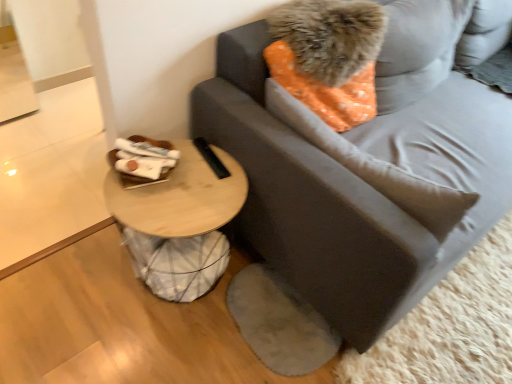
How much space does orange dotted fabric pillow at upper right, the first pillow positioned from the top, occupy vertically?

17.03 inches.

How much space does orange dotted fabric pillow at upper right, which is counted as the 2th pillow, starting from the bottom, occupy horizontally?

orange dotted fabric pillow at upper right, which is counted as the 2th pillow, starting from the bottom, is 9.62 inches in width.

Image resolution: width=512 pixels, height=384 pixels. I want to click on woodenmaterial/texturetable at lower left, so click(180, 222).

Which object is positioned more to the right, gray fabric studio couch at center or woodenmaterial/texturetable at lower left?

Positioned to the right is gray fabric studio couch at center.

Does point (506, 149) lie behind point (196, 233)?

Yes, it is behind point (196, 233).

Locate an element on the screen. This screenshot has height=384, width=512. table below the gray fabric studio couch at center (from the image's perspective) is located at coordinates (180, 222).

Is gray fabric studio couch at center outside of woodenmaterial/texturetable at lower left?

Yes.

Based on the photo, does orange dotted fabric pillow at upper right, the first pillow positioned from the top, turn towards gray fabric pillow at upper right, acting as the 2th pillow starting from the top?

No, orange dotted fabric pillow at upper right, the first pillow positioned from the top, is not oriented towards gray fabric pillow at upper right, acting as the 2th pillow starting from the top.

Which object is further away from the camera, orange dotted fabric pillow at upper right, which is counted as the 2th pillow, starting from the bottom, or gray fabric pillow at upper right, the 1th pillow when ordered from bottom to top?

orange dotted fabric pillow at upper right, which is counted as the 2th pillow, starting from the bottom, is behind.

Is orange dotted fabric pillow at upper right, the first pillow positioned from the top, taller than gray fabric pillow at upper right, acting as the 2th pillow starting from the top?

Indeed, orange dotted fabric pillow at upper right, the first pillow positioned from the top, has a greater height compared to gray fabric pillow at upper right, acting as the 2th pillow starting from the top.

Is gray fabric pillow at upper right, acting as the 2th pillow starting from the top, a part of orange dotted fabric pillow at upper right, the first pillow positioned from the top?

Actually, gray fabric pillow at upper right, acting as the 2th pillow starting from the top, is outside orange dotted fabric pillow at upper right, the first pillow positioned from the top.

Considering the relative sizes of woodenmaterial/texturetable at lower left and gray fabric studio couch at center in the image provided, is woodenmaterial/texturetable at lower left taller than gray fabric studio couch at center?

No.

Is gray fabric studio couch at center surrounded by woodenmaterial/texturetable at lower left?

No, gray fabric studio couch at center is not surrounded by woodenmaterial/texturetable at lower left.

Does point (201, 155) lie in front of point (465, 222)?

No, (201, 155) is behind (465, 222).

From a real-world perspective, which object rests below the other?

woodenmaterial/texturetable at lower left, from a real-world perspective.

Is gray fabric pillow at upper right, acting as the 2th pillow starting from the top, facing towards woodenmaterial/texturetable at lower left?

No, gray fabric pillow at upper right, acting as the 2th pillow starting from the top, is not turned towards woodenmaterial/texturetable at lower left.

Considering the positions of objects gray fabric pillow at upper right, acting as the 2th pillow starting from the top, and woodenmaterial/texturetable at lower left in the image provided, who is behind, gray fabric pillow at upper right, acting as the 2th pillow starting from the top, or woodenmaterial/texturetable at lower left?

Positioned behind is woodenmaterial/texturetable at lower left.

The height and width of the screenshot is (384, 512). I want to click on table on the left of the gray fabric pillow at upper right, the 1th pillow when ordered from bottom to top, so click(x=180, y=222).

From the image's perspective, does gray fabric pillow at upper right, acting as the 2th pillow starting from the top, appear lower than woodenmaterial/texturetable at lower left?

Incorrect, from the image's perspective, gray fabric pillow at upper right, acting as the 2th pillow starting from the top, is higher than woodenmaterial/texturetable at lower left.

From the image's perspective, is woodenmaterial/texturetable at lower left located beneath gray fabric pillow at upper right, acting as the 2th pillow starting from the top?

Yes, from the image's perspective, woodenmaterial/texturetable at lower left is beneath gray fabric pillow at upper right, acting as the 2th pillow starting from the top.

Considering the points (141, 237) and (374, 158), which point is in front, point (141, 237) or point (374, 158)?

The point (374, 158) is closer to the camera.

Does woodenmaterial/texturetable at lower left have a lesser height compared to gray fabric pillow at upper right, the 1th pillow when ordered from bottom to top?

No, woodenmaterial/texturetable at lower left is not shorter than gray fabric pillow at upper right, the 1th pillow when ordered from bottom to top.

Between gray fabric pillow at upper right, acting as the 2th pillow starting from the top, and gray fabric studio couch at center, which one has larger size?

Bigger between the two is gray fabric studio couch at center.

From the image's perspective, relative to gray fabric studio couch at center, is gray fabric pillow at upper right, acting as the 2th pillow starting from the top, above or below?

From the image's perspective, gray fabric pillow at upper right, acting as the 2th pillow starting from the top, appears below gray fabric studio couch at center.

The height and width of the screenshot is (384, 512). Find the location of `studio couch lying above the gray fabric pillow at upper right, acting as the 2th pillow starting from the top (from the image's perspective)`. studio couch lying above the gray fabric pillow at upper right, acting as the 2th pillow starting from the top (from the image's perspective) is located at coordinates (369, 164).

Which object is more forward, gray fabric pillow at upper right, the 1th pillow when ordered from bottom to top, or gray fabric studio couch at center?

gray fabric studio couch at center is more forward.

Which object is further away from the camera, gray fabric studio couch at center or gray fabric pillow at upper right, the 1th pillow when ordered from bottom to top?

Positioned behind is gray fabric pillow at upper right, the 1th pillow when ordered from bottom to top.

Between gray fabric studio couch at center and gray fabric pillow at upper right, the 1th pillow when ordered from bottom to top, which one has more height?

With more height is gray fabric studio couch at center.

Identify the location of studio couch lying above the woodenmaterial/texturetable at lower left (from the image's perspective). The height and width of the screenshot is (384, 512). [369, 164].

Identify the location of pillow above the gray fabric pillow at upper right, acting as the 2th pillow starting from the top (from a real-world perspective). The image size is (512, 384). (417, 49).

When comparing their distances from gray fabric pillow at upper right, the 1th pillow when ordered from bottom to top, does gray fabric studio couch at center or orange dotted fabric pillow at upper right, which is counted as the 2th pillow, starting from the bottom, seem closer?

Based on the image, gray fabric studio couch at center appears to be nearer to gray fabric pillow at upper right, the 1th pillow when ordered from bottom to top.

From the image, which object appears to be farther from orange dotted fabric pillow at upper right, which is counted as the 2th pillow, starting from the bottom, woodenmaterial/texturetable at lower left or gray fabric studio couch at center?

woodenmaterial/texturetable at lower left.

From the image, which object appears to be nearer to woodenmaterial/texturetable at lower left, orange dotted fabric pillow at upper right, which is counted as the 2th pillow, starting from the bottom, or gray fabric pillow at upper right, acting as the 2th pillow starting from the top?

gray fabric pillow at upper right, acting as the 2th pillow starting from the top, is closer to woodenmaterial/texturetable at lower left.

When comparing their distances from gray fabric studio couch at center, does gray fabric pillow at upper right, the 1th pillow when ordered from bottom to top, or woodenmaterial/texturetable at lower left seem further?

Among the two, woodenmaterial/texturetable at lower left is located further to gray fabric studio couch at center.

When comparing their distances from orange dotted fabric pillow at upper right, which is counted as the 2th pillow, starting from the bottom, does gray fabric studio couch at center or woodenmaterial/texturetable at lower left seem closer?

gray fabric studio couch at center is positioned closer to the anchor orange dotted fabric pillow at upper right, which is counted as the 2th pillow, starting from the bottom.

Estimate the real-world distances between objects in this image. Which object is further from gray fabric pillow at upper right, the 1th pillow when ordered from bottom to top, woodenmaterial/texturetable at lower left or orange dotted fabric pillow at upper right, which is counted as the 2th pillow, starting from the bottom?

orange dotted fabric pillow at upper right, which is counted as the 2th pillow, starting from the bottom, is positioned further to the anchor gray fabric pillow at upper right, the 1th pillow when ordered from bottom to top.

Consider the image. When comparing their distances from orange dotted fabric pillow at upper right, the first pillow positioned from the top, does gray fabric pillow at upper right, acting as the 2th pillow starting from the top, or woodenmaterial/texturetable at lower left seem further?

The object further to orange dotted fabric pillow at upper right, the first pillow positioned from the top, is woodenmaterial/texturetable at lower left.

When comparing their distances from gray fabric studio couch at center, does woodenmaterial/texturetable at lower left or orange dotted fabric pillow at upper right, which is counted as the 2th pillow, starting from the bottom, seem further?

woodenmaterial/texturetable at lower left.

Locate an element on the screen. The width and height of the screenshot is (512, 384). pillow positioned between gray fabric studio couch at center and orange dotted fabric pillow at upper right, which is counted as the 2th pillow, starting from the bottom, from near to far is located at coordinates (375, 165).

This screenshot has height=384, width=512. I want to click on pillow located between woodenmaterial/texturetable at lower left and orange dotted fabric pillow at upper right, which is counted as the 2th pillow, starting from the bottom, in the left-right direction, so (375, 165).